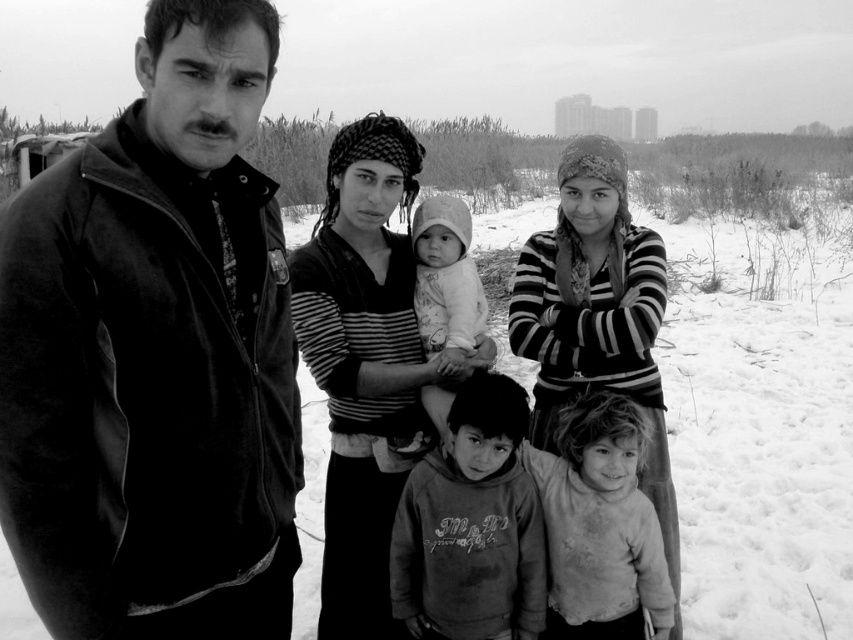
You are standing at the point labeled point (659,314) and want to walk to the point labeled point (376,614). Which direction should you face to move towards the second point?

Since point (376,614) is behind point (659,314), you should face away from the camera to move towards it.

You are a photographer trying to capture a group photo of the velvet black jacket at left and the white soft baby at center. Considering their heights, which one should you adjust the camera angle for to ensure both are in focus?

The velvet black jacket at left is much taller than the white soft baby at center, so you should lower the camera angle to include both the taller jacket and the shorter baby in focus.

Based on the scene description, can you determine which object is positioned higher between the striped fabric adult at center and the striped knit sweater at center?

The striped fabric adult at center is positioned above the striped knit sweater at center.